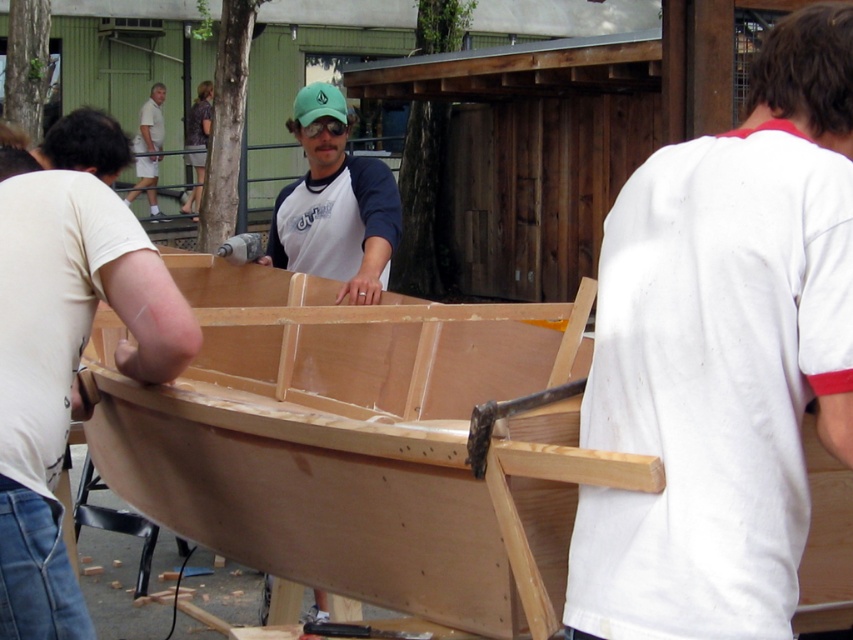
Question: Is white cotton shirt at right thinner than green matte baseball cap at center?

Choices:
 (A) yes
 (B) no

Answer: (A)

Question: From the image, what is the correct spatial relationship of white cotton shirt at right in relation to green matte baseball cap at center?

Choices:
 (A) right
 (B) left

Answer: (A)

Question: Does light brown wood plank at center appear over matte wood boat at center?

Choices:
 (A) yes
 (B) no

Answer: (B)

Question: Estimate the real-world distances between objects in this image. Which object is closer to the white cotton shirt at upper left?

Choices:
 (A) matte wood boat at center
 (B) white cotton shirt at right
 (C) light brown wood plank at center

Answer: (A)

Question: Among these points, which one is nearest to the camera?

Choices:
 (A) click(x=10, y=627)
 (B) click(x=344, y=148)

Answer: (A)

Question: Which point is farther to the camera?

Choices:
 (A) white cotton shirt at right
 (B) matte wood boat at center
 (C) white cotton shirt at upper left

Answer: (C)